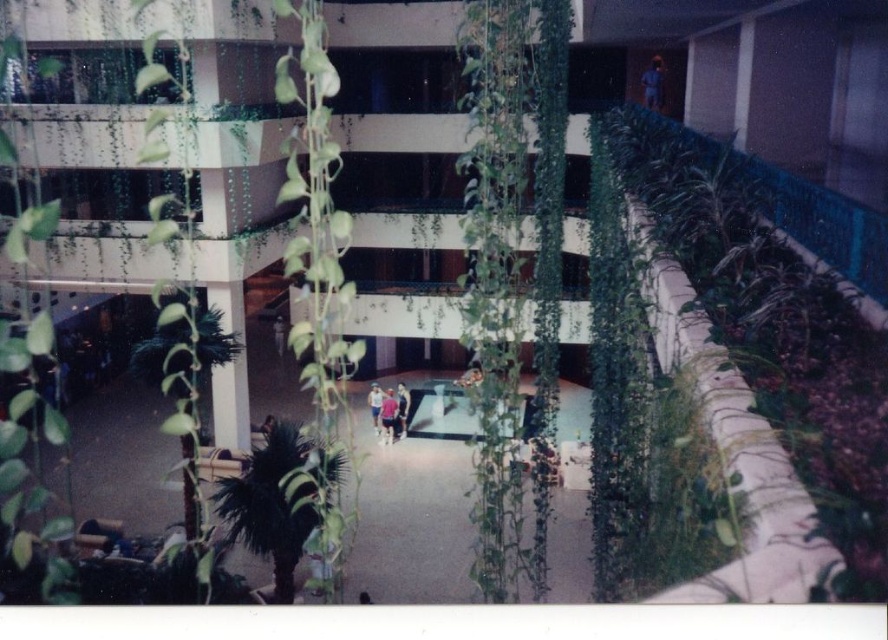
Is point (236, 524) positioned before point (280, 349)?

Yes.

Is green leafy plant at lower left bigger than dark blue shirt at center?

Correct, green leafy plant at lower left is larger in size than dark blue shirt at center.

This screenshot has height=640, width=888. What are the coordinates of `green leafy plant at lower left` in the screenshot? It's located at (276, 500).

In order to click on white cotton shirt at center in this screenshot , I will do `click(375, 404)`.

Which is in front, point (379, 387) or point (280, 321)?

Positioned in front is point (379, 387).

I want to click on white cotton shirt at center, so click(x=375, y=404).

Is matte pink shorts at center to the right of dark blue shirt at center from the viewer's perspective?

Indeed, matte pink shorts at center is positioned on the right side of dark blue shirt at center.

Which is more to the left, matte pink shorts at center or dark blue shirt at center?

dark blue shirt at center is more to the left.

What are the coordinates of `matte pink shorts at center` in the screenshot? It's located at (402, 408).